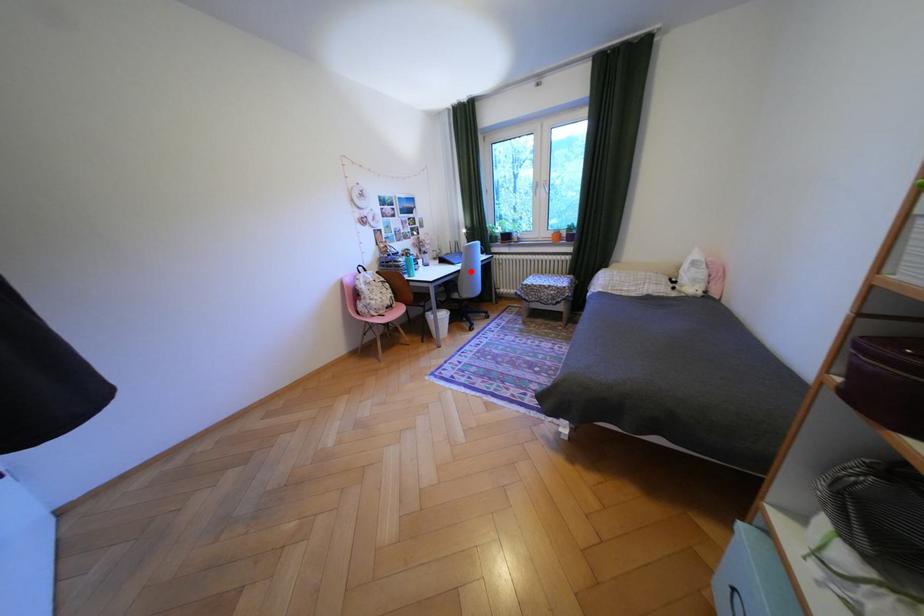
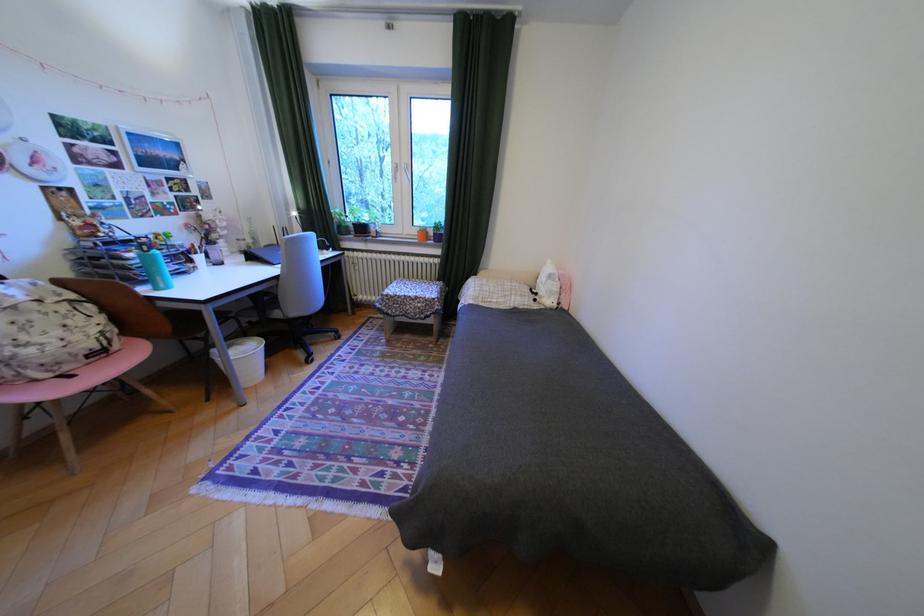
Question: A red point is marked in image1. In image2, is the corresponding 3D point closer to the camera or farther? Reply with the corresponding letter.

Choices:
 (A) The corresponding 3D point is closer.
 (B) The corresponding 3D point is farther.

Answer: (A)